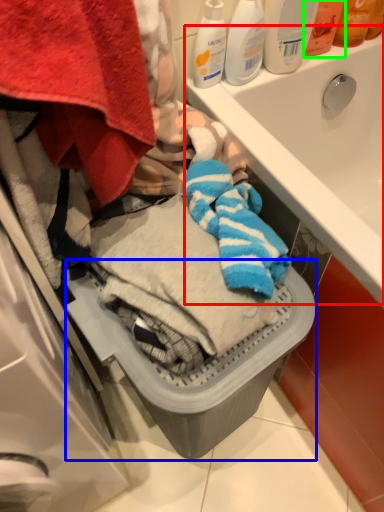
Question: Which object is the closest to the sink (highlighted by a red box)? Choose among these: dish washer (highlighted by a blue box) or toiletry (highlighted by a green box).

Choices:
 (A) dish washer
 (B) toiletry

Answer: (B)